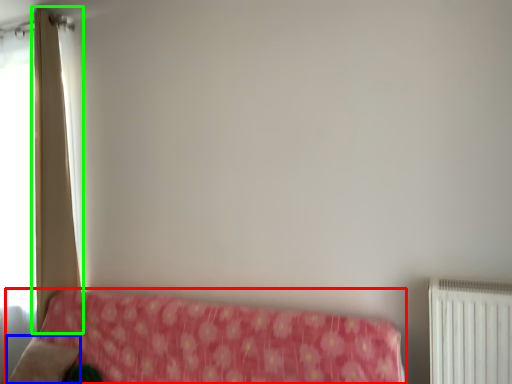
Question: Estimate the real-world distances between objects in this image. Which object is closer to furniture (highlighted by a red box), pillow (highlighted by a blue box) or curtain (highlighted by a green box)?

Choices:
 (A) pillow
 (B) curtain

Answer: (A)